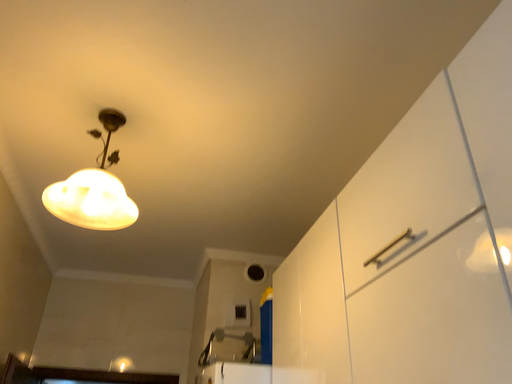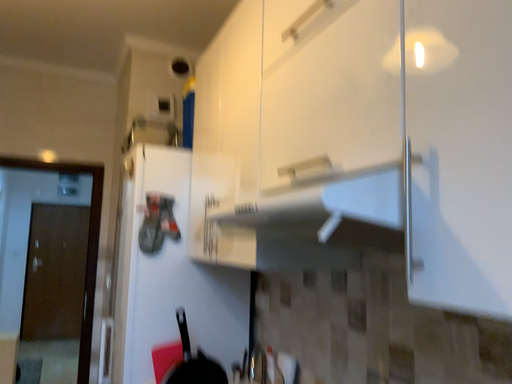
Question: How did the camera likely rotate when shooting the video?

Choices:
 (A) rotated right
 (B) rotated left

Answer: (A)